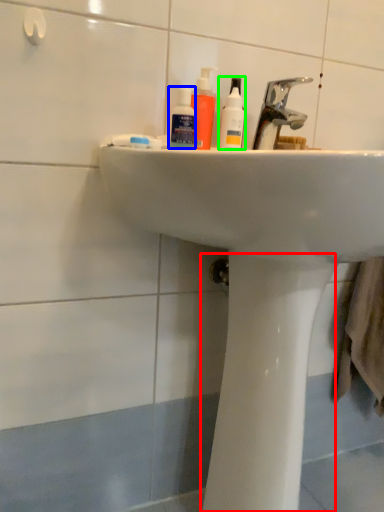
Question: Which is nearer to the bidet (highlighted by a red box)? mouthwash (highlighted by a blue box) or cleaning product (highlighted by a green box).

Choices:
 (A) mouthwash
 (B) cleaning product

Answer: (B)